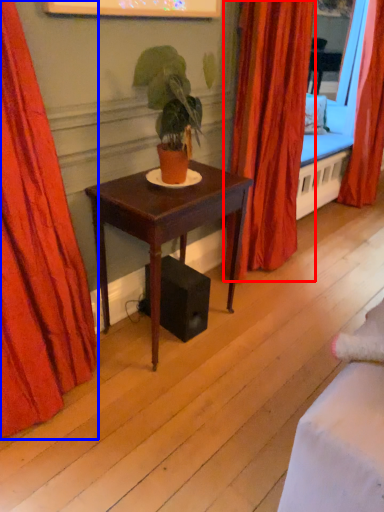
Question: Which of the following is the closest to the observer, curtain (highlighted by a red box) or curtain (highlighted by a blue box)?

Choices:
 (A) curtain
 (B) curtain

Answer: (B)